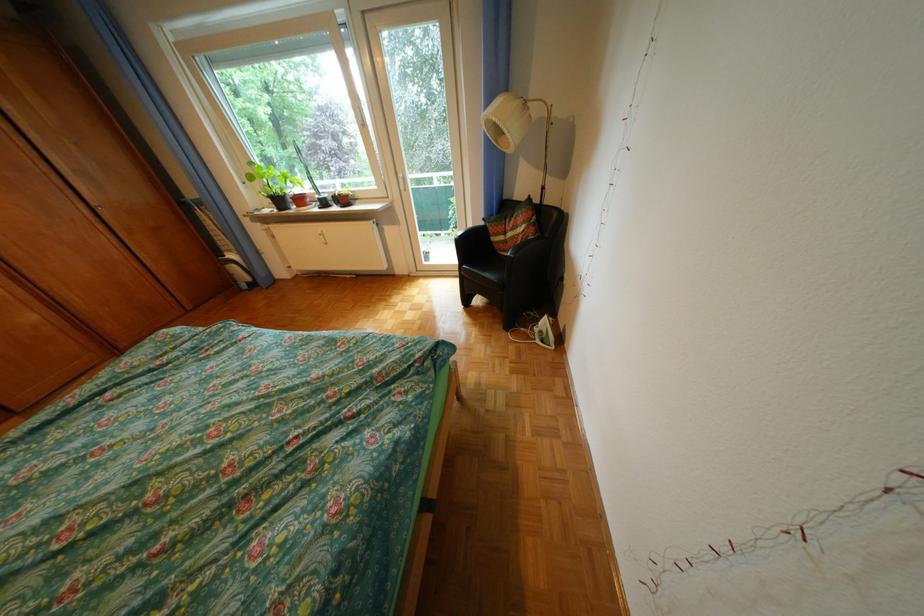
At what (x,y) coordinates should I click in order to perform the action: click on chair sitting surface. Please return your answer as a coordinate pair (x, y). Looking at the image, I should click on (485, 270).